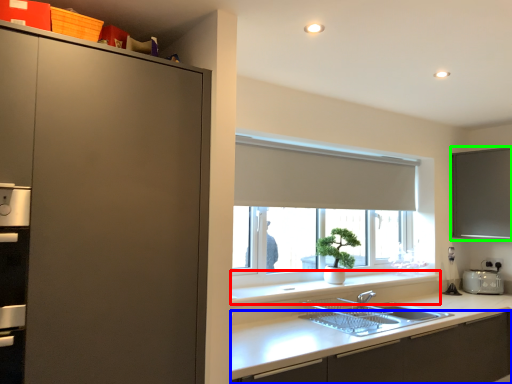
Question: Which is nearer to the window sill (highlighted by a red box)? cabinetry (highlighted by a blue box) or window screen (highlighted by a green box).

Choices:
 (A) cabinetry
 (B) window screen

Answer: (A)